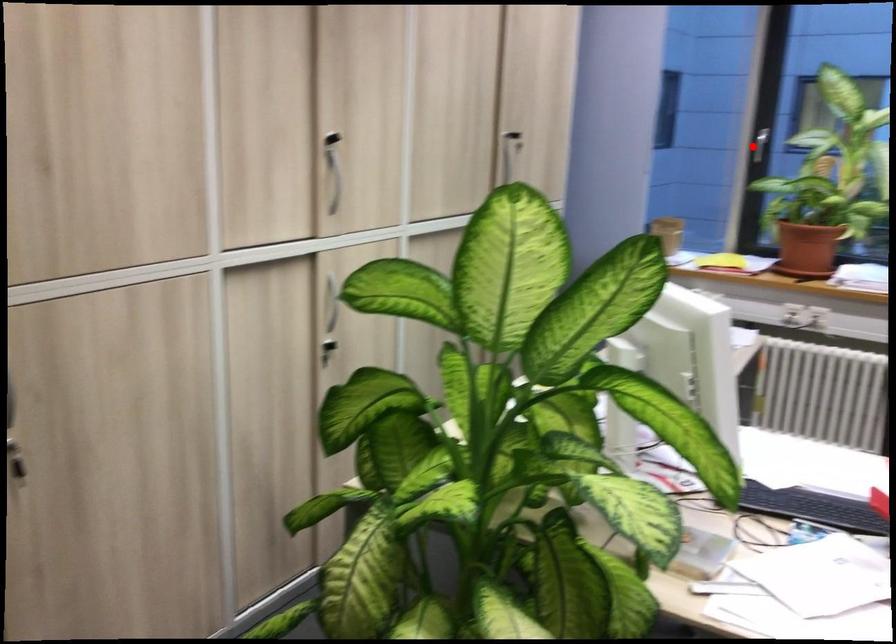
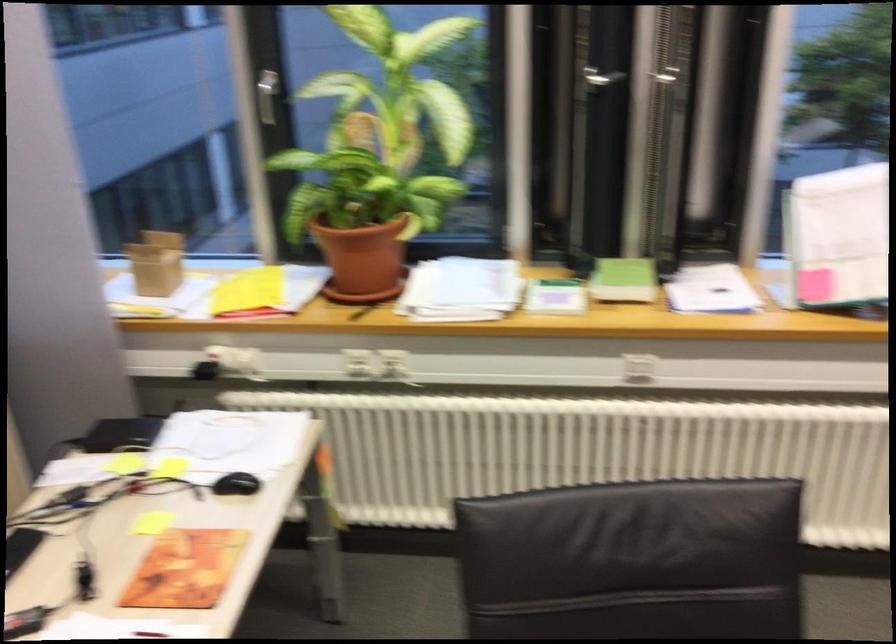
Where in the second image is the point corresponding to the highlighted location from the first image?

(266, 96)